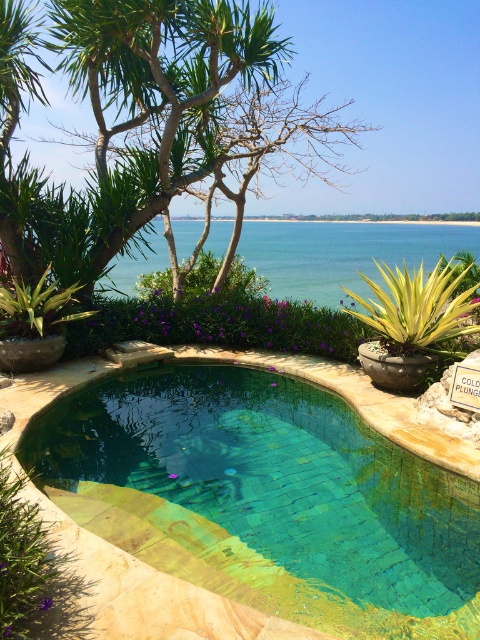
Question: Which object is the farthest from the teal mosaic pool at center?

Choices:
 (A) green leafy tree at upper left
 (B) clear blue water at center

Answer: (B)

Question: Is teal mosaic pool at center to the left of green leafy tree at upper left from the viewer's perspective?

Choices:
 (A) no
 (B) yes

Answer: (A)

Question: Which point is closer to the camera?

Choices:
 (A) teal mosaic pool at center
 (B) clear blue water at center
 (C) green leafy tree at upper left

Answer: (A)

Question: Is teal mosaic pool at center thinner than green leafy tree at upper left?

Choices:
 (A) yes
 (B) no

Answer: (A)

Question: Is green leafy tree at upper left further to the viewer compared to clear blue water at center?

Choices:
 (A) no
 (B) yes

Answer: (A)

Question: Which of the following is the farthest from the observer?

Choices:
 (A) (305, 275)
 (B) (279, 456)
 (C) (72, 4)

Answer: (A)